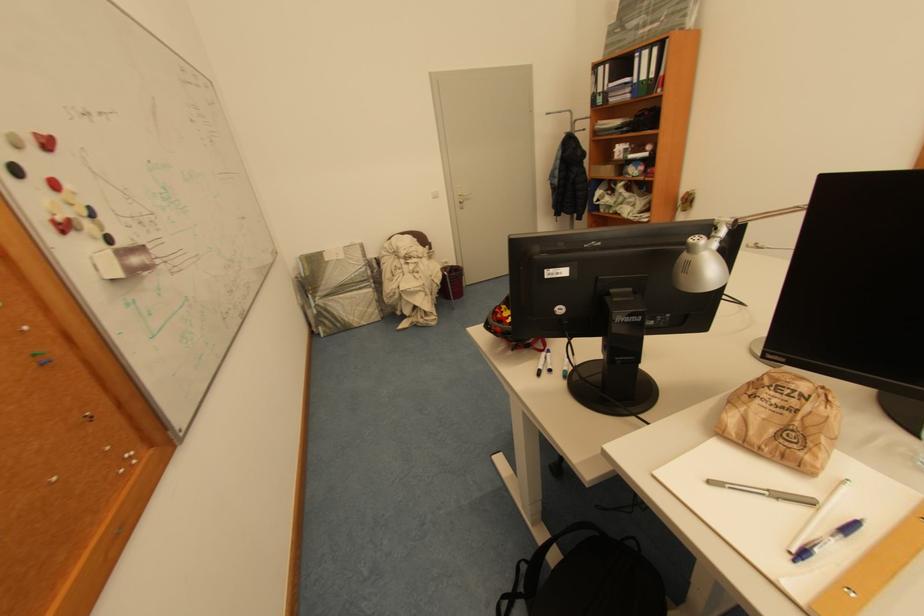
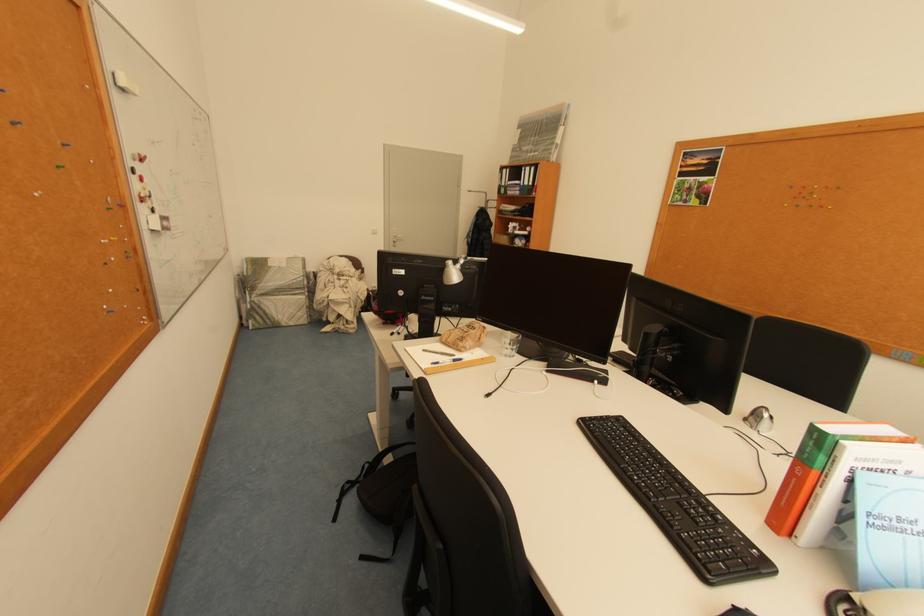
Locate, in the second image, the point that corresponds to (x=468, y=204) in the first image.

(402, 243)